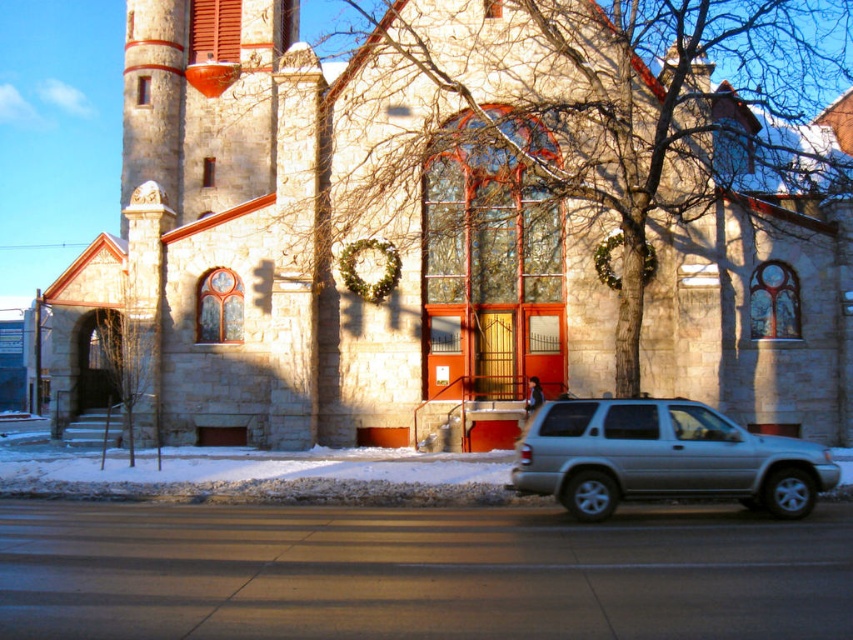
You are a photographer planning to capture the stone church at center and the silver metallic suv at lower right in a single frame. Based on their sizes, which object should you position closer to the camera to ensure both are visible without cropping?

The stone church at center is wider than the silver metallic suv at lower right. To ensure both are visible without cropping, position the silver metallic suv at lower right closer to the camera since it is narrower, allowing the wider stone church at center to fit in the frame when placed farther back.

You are a delivery driver who needs to park your silver metallic suv at lower right as close as possible to the stone church at center without blocking the entrance. The parking space must be at least 12 meters away from the church. Can you park your suv closer than the required distance?

The distance between the stone church at center and the silver metallic suv at lower right is 11.79 meters, which is less than the required 12 meters. Therefore, parking the suv at lower right closer than the required distance would violate the parking rule, so you cannot park there.

You are a photographer planning to take a photo of the stone church at center and the silver metallic suv at lower right. Considering their sizes, which object should you focus on first to ensure it appears larger in the photo?

The stone church at center is much taller than the silver metallic suv at lower right, so you should focus on the stone church at center first to ensure it appears larger in the photo.